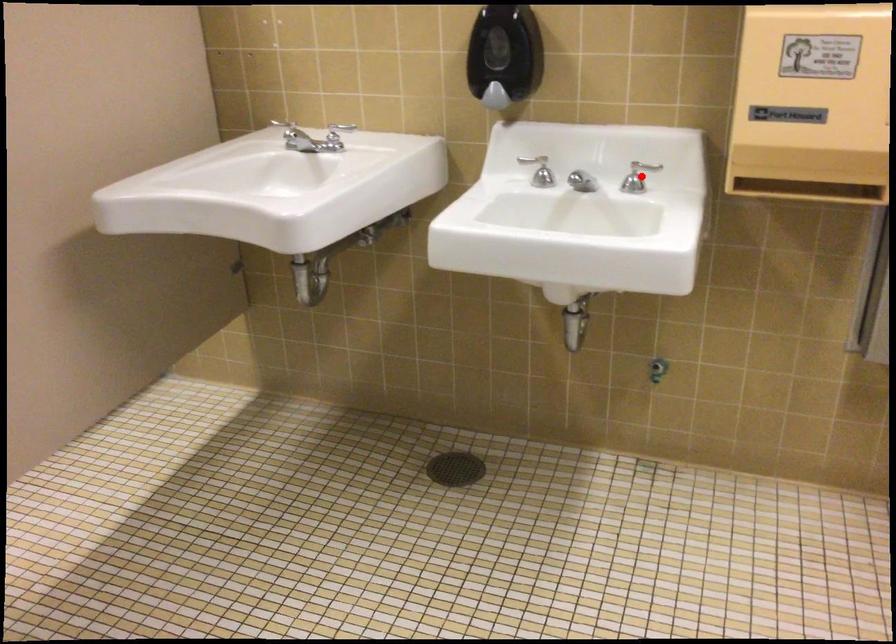
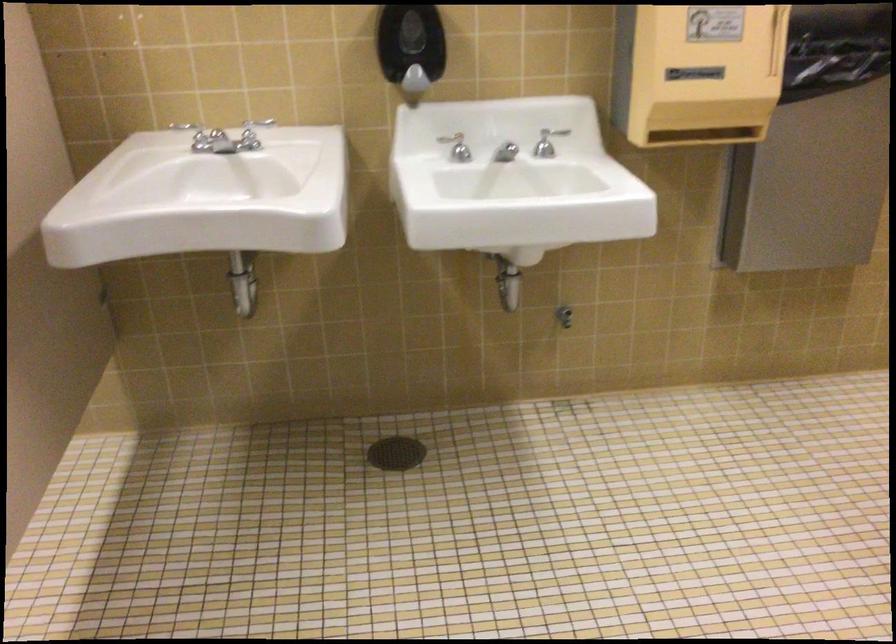
In the second image, find the point that corresponds to the highlighted location in the first image.

(547, 142)